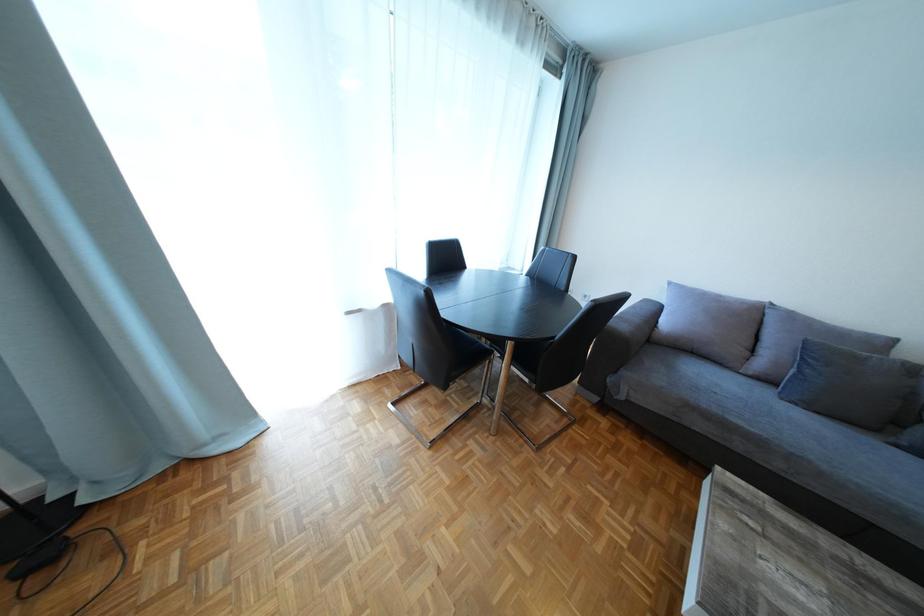
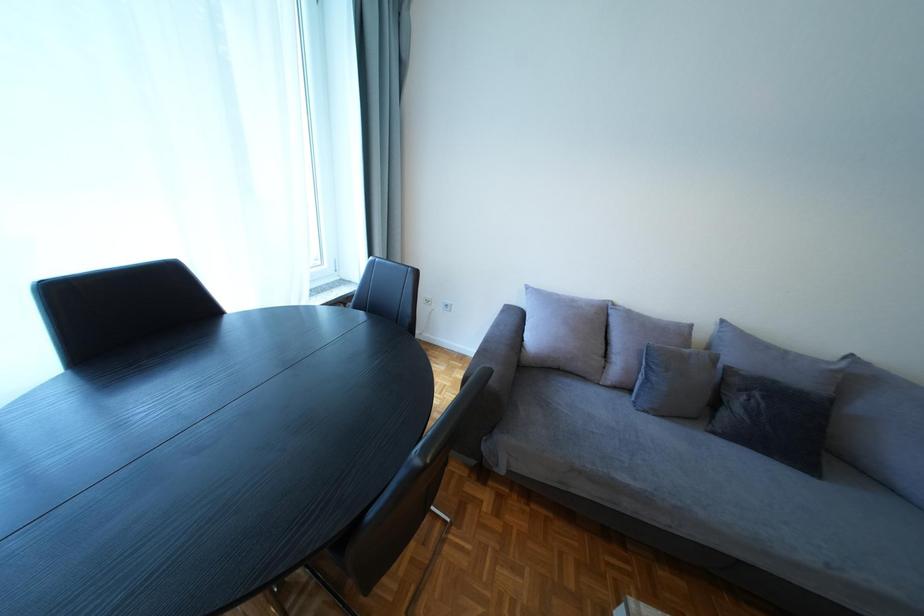
In a continuous first-person perspective shot, in which direction is the camera moving?

The cameraman walked toward right, forward.